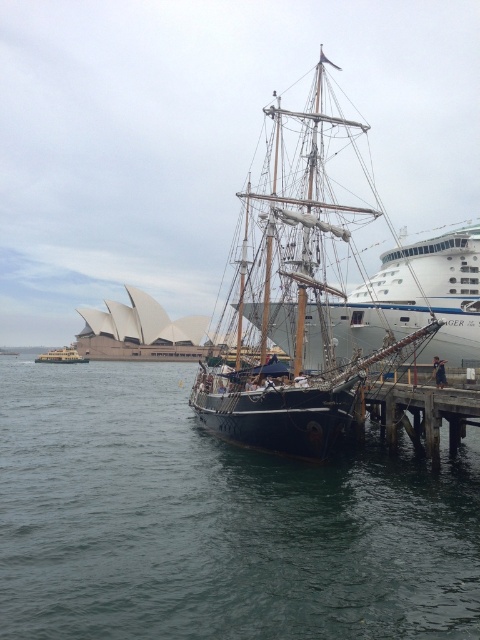
You are a photographer planning to take a photo of the Sydney Opera House from the wooden pier at lower right and the yellow matte ferry at lower left. Which object will allow you to capture the Opera House more clearly in the background?

The wooden pier at lower right is taller than the yellow matte ferry at lower left, so taking the photo from the wooden pier at lower right will provide a clearer view of the Sydney Opera House in the background.

Based on the photo, you are a photographer planning to take a photo of the Sydney Opera House from the water. You have access to both the wooden pier at lower right and the yellow matte ferry at lower left. Considering their sizes, which location would allow you to include more of the Opera House in your shot?

The yellow matte ferry at lower left is larger than the wooden pier at lower right, so you can position yourself further back on the ferry to capture a wider view of the Sydney Opera House.

You are a tour guide on a small boat that is 20 feet long. You want to navigate from the dark blue water at center to the wooden pier at lower right. Is there enough space for your boat to maneuver safely between these two points?

The distance between the dark blue water at center and the wooden pier at lower right is 33.77 feet, which is greater than the boat length of 20 feet. Therefore, there is sufficient space for the boat to maneuver safely between these two points.